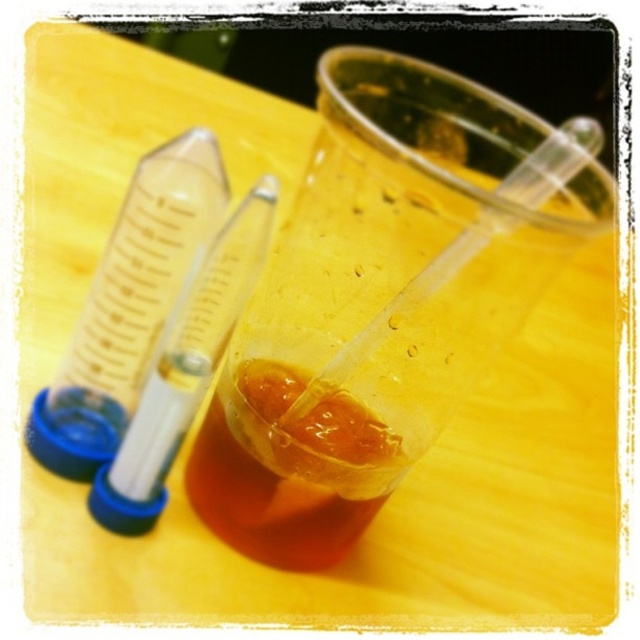
You are a researcher who needs to place a 5.5 inch tall beaker on the table. The translucent plastic cup at center is in the way. Can you slide the beaker past the cup without moving it?

The distance between the translucent plastic cup at center and the camera is 6.78 inches. Since the beaker is only 5.5 inches tall, it can be slid past the cup as the space available is greater than the beaker height.

Based on the photo, you are a lab assistant who needs to pour liquid from the transparent plastic test tube at left into the translucent plastic cup at center. Based on their positions, can you do this without moving either object?

The translucent plastic cup at center is below the transparent plastic test tube at left, so yes, you can pour the liquid from the transparent plastic test tube at left into the translucent plastic cup at center without moving either object.

You are a lab assistant who needs to pour the translucent amber liquid at center into the transparent plastic test tube at left. Will the test tube be able to hold all the liquid without overflowing?

The transparent plastic test tube at left has a greater height compared to the translucent amber liquid at center. This means the test tube is taller, but the volume capacity isn not specified. However, since height alone doesn not guarantee sufficient capacity, we cannot confirm if it will hold all the liquid without overflowing. Additional information about the diameter or volume is needed to determine this.